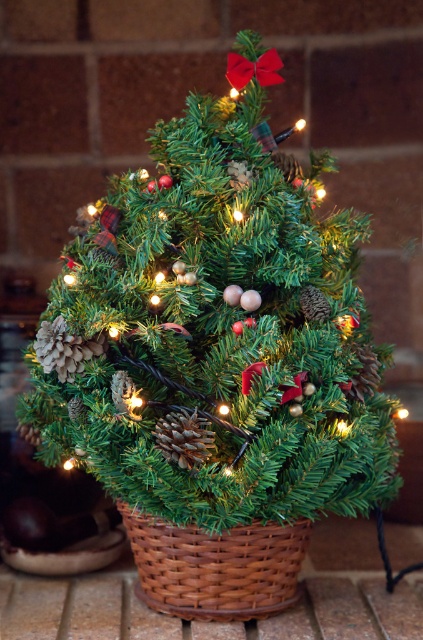
Question: Which object is closer to the camera taking this photo?

Choices:
 (A) green matte christmas tree at center
 (B) woven brown basket at center

Answer: (A)

Question: Which of the following is the farthest from the observer?

Choices:
 (A) brown textured pine cone at center
 (B) woven brown basket at center
 (C) green matte christmas tree at center

Answer: (B)

Question: Does woven brown basket at center appear on the right side of brown textured pine cone at center?

Choices:
 (A) no
 (B) yes

Answer: (B)

Question: Which object is closer to the camera taking this photo?

Choices:
 (A) green matte christmas tree at center
 (B) woven brown basket at center
 (C) brown textured pine cone at center

Answer: (A)

Question: Can you confirm if woven brown basket at center is wider than brown textured pine cone at center?

Choices:
 (A) no
 (B) yes

Answer: (B)

Question: Is green matte christmas tree at center closer to the viewer compared to brown textured pine cone at center?

Choices:
 (A) no
 (B) yes

Answer: (B)